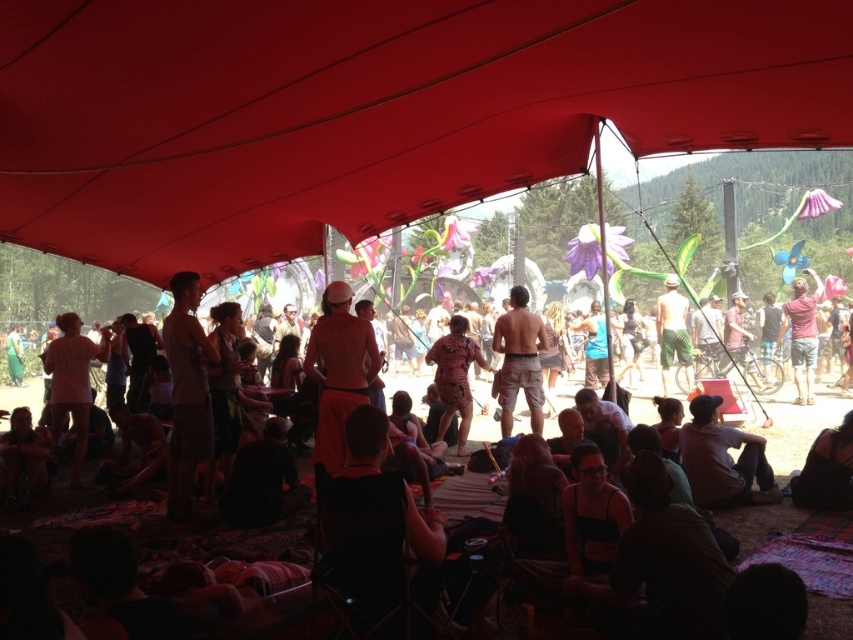
You are standing at the entrance of the tent and want to reach both the point at coordinates [445,374] and the point at coordinates [662,307]. Which point should you reach first to minimize the distance walked?

You should reach point [445,374] first because it is closer to the viewer than point [662,307]. Since you are starting from the entrance, reaching the closer point first would require less walking distance.